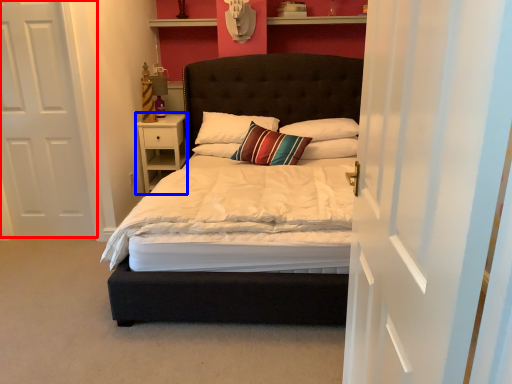
Question: Which object is further to the camera taking this photo, door (highlighted by a red box) or nightstand (highlighted by a blue box)?

Choices:
 (A) door
 (B) nightstand

Answer: (B)